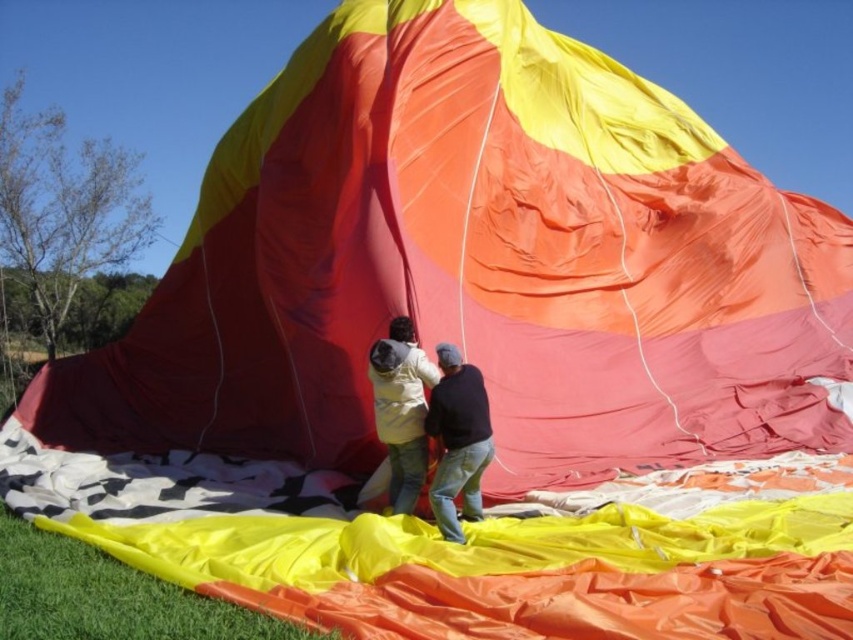
Who is shorter, black matte shirt at center or matte yellow jacket at center?

With less height is black matte shirt at center.

Who is more distant from viewer, (x=433, y=493) or (x=412, y=474)?

The point (x=412, y=474) is behind.

I want to click on black matte shirt at center, so click(x=457, y=440).